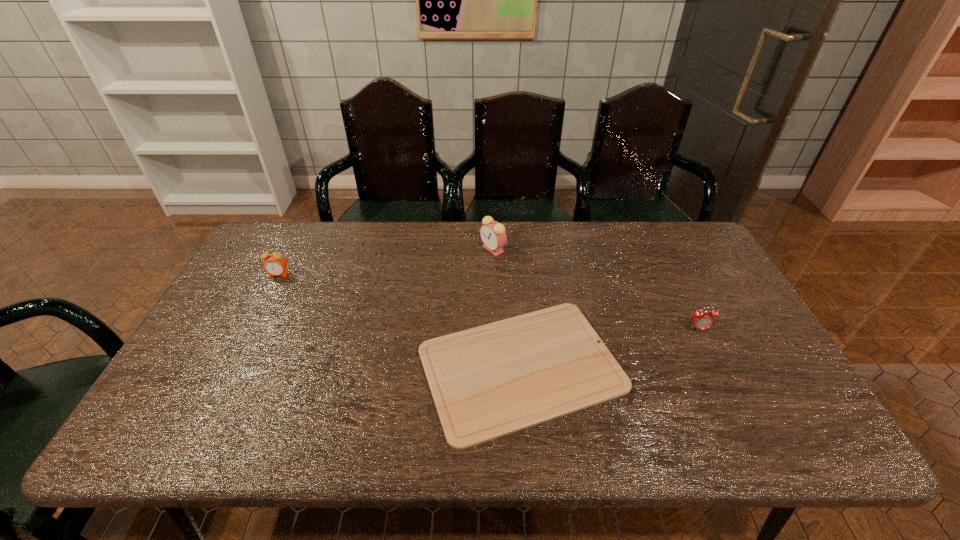
The height and width of the screenshot is (540, 960). Identify the location of the farthest alarm clock. (493, 235).

The width and height of the screenshot is (960, 540). What are the coordinates of `the second alarm clock from right to left` in the screenshot? It's located at (493, 235).

The image size is (960, 540). What are the coordinates of `the third nearest object` in the screenshot? It's located at (x=275, y=264).

Locate an element on the screen. The height and width of the screenshot is (540, 960). the leftmost alarm clock is located at coordinates (275, 264).

Where is `the rightmost object`? The height and width of the screenshot is (540, 960). the rightmost object is located at coordinates (702, 320).

Where is `the rightmost alarm clock`? the rightmost alarm clock is located at coordinates [702, 320].

In order to click on the shortest object in this screenshot , I will do `click(490, 381)`.

At what (x,y) coordinates should I click in order to perform the action: click on free space located on the face of the second alarm clock from right to left. Please return your answer as a coordinate pair (x, y). Looking at the image, I should click on (459, 249).

I want to click on free spot located on the face of the second alarm clock from right to left, so click(x=423, y=249).

Locate an element on the screen. The height and width of the screenshot is (540, 960). free region located on the face of the second alarm clock from right to left is located at coordinates (405, 249).